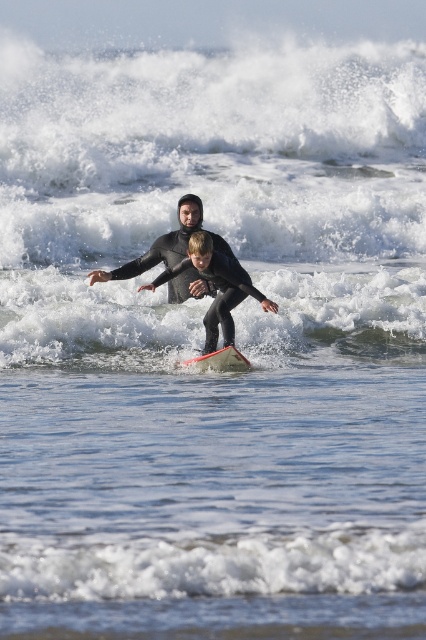
Who is shorter, black matte wetsuit at center or orange matte surfboard at center?

Standing shorter between the two is orange matte surfboard at center.

Identify the location of black matte wetsuit at center. This screenshot has height=640, width=426. tap(195, 272).